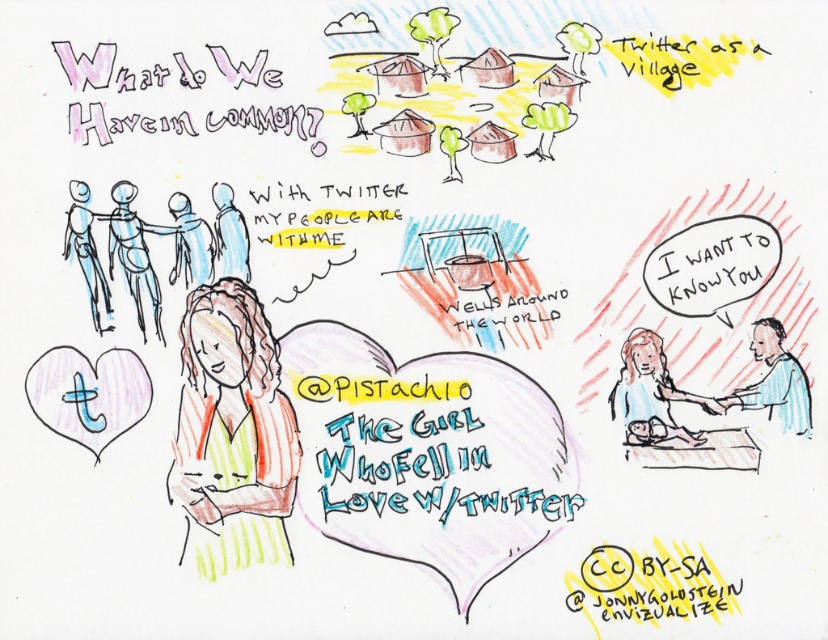
Question: Considering the real-world distances, which object is closest to the blue shirt at right?

Choices:
 (A) green striped shirt at center
 (B) matte blue heart at lower left

Answer: (A)

Question: Is blue shirt at right positioned behind yellow text at center?

Choices:
 (A) no
 (B) yes

Answer: (A)

Question: Among these points, which one is nearest to the camera?

Choices:
 (A) (321, 451)
 (B) (104, 289)
 (C) (773, 365)
 (D) (188, 205)

Answer: (B)

Question: Is whitetextcc by-sa at lower right to the left of blue sketchy figure at left from the viewer's perspective?

Choices:
 (A) yes
 (B) no

Answer: (B)

Question: Can you confirm if green striped shirt at center is wider than blue paper doll at upper center?

Choices:
 (A) no
 (B) yes

Answer: (B)

Question: Among these objects, which one is nearest to the camera?

Choices:
 (A) matte blue figure at upper left
 (B) blue sketchy figure at left
 (C) whitetextcc by-sa at lower right

Answer: (B)